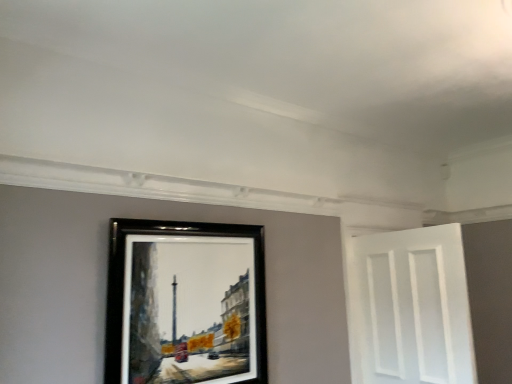
Question: In terms of height, does white matte door at right look taller or shorter compared to black wooden picture frame at upper center?

Choices:
 (A) tall
 (B) short

Answer: (A)

Question: From a real-world perspective, relative to black wooden picture frame at upper center, is white matte door at right vertically above or below?

Choices:
 (A) above
 (B) below

Answer: (B)

Question: Considering their positions, is white matte door at right located in front of or behind black wooden picture frame at upper center?

Choices:
 (A) behind
 (B) front

Answer: (A)

Question: Is black wooden picture frame at upper center taller or shorter than white matte door at right?

Choices:
 (A) tall
 (B) short

Answer: (B)

Question: Does point (165, 311) appear closer or farther from the camera than point (375, 299)?

Choices:
 (A) closer
 (B) farther

Answer: (A)

Question: From a real-world perspective, is black wooden picture frame at upper center physically located above or below white matte door at right?

Choices:
 (A) above
 (B) below

Answer: (A)

Question: Is black wooden picture frame at upper center situated inside white matte door at right or outside?

Choices:
 (A) outside
 (B) inside

Answer: (A)